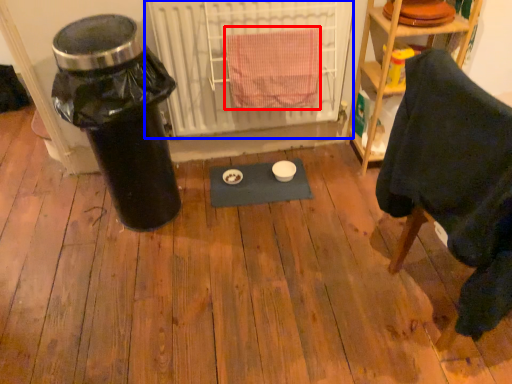
Question: Which object is closer to the camera taking this photo, bath towel (highlighted by a red box) or radiator (highlighted by a blue box)?

Choices:
 (A) bath towel
 (B) radiator

Answer: (A)